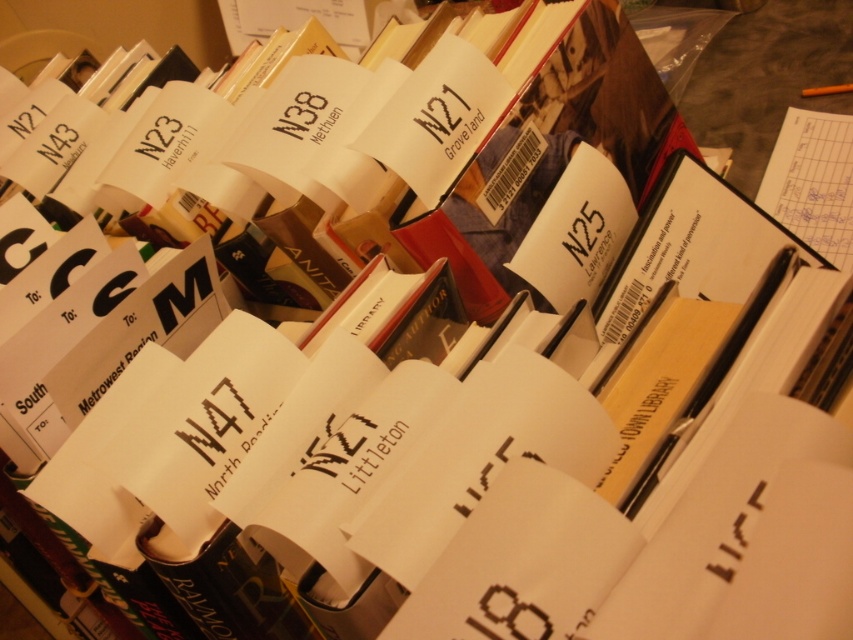
Can you confirm if yellow paper at right is wider than black paper at center?

Yes, yellow paper at right is wider than black paper at center.

Can you confirm if yellow paper at right is thinner than black paper at center?

Incorrect, yellow paper at right's width is not less than black paper at center's.

Who is more distant from viewer, (614, 406) or (749, 516)?

Positioned behind is point (614, 406).

Identify the location of yellow paper at right. (639, 422).